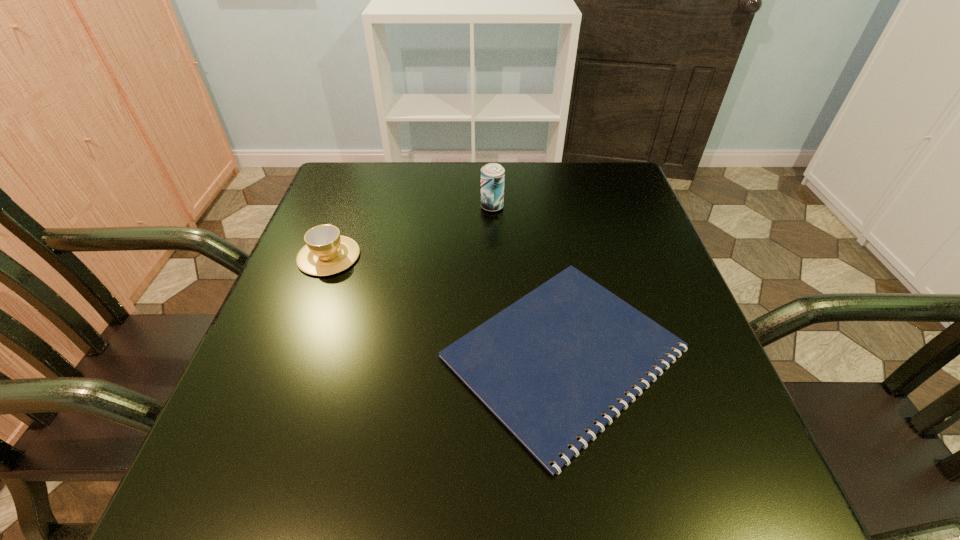
The height and width of the screenshot is (540, 960). I want to click on free space between the leftmost object and the farthest object, so click(411, 232).

Identify the location of vacant space that's between the cup and the farthest object. This screenshot has width=960, height=540. (411, 232).

The width and height of the screenshot is (960, 540). What are the coordinates of `empty location between the shortest object and the tallest object` in the screenshot? It's located at (528, 280).

At what (x,y) coordinates should I click in order to perform the action: click on free area in between the shortest object and the cup. Please return your answer as a coordinate pair (x, y). Looking at the image, I should click on (446, 305).

This screenshot has height=540, width=960. Find the location of `vacant area between the tallest object and the shortest object`. vacant area between the tallest object and the shortest object is located at coordinates (528, 280).

Identify the location of free space that is in between the leftmost object and the farthest object. (411, 232).

Locate an element on the screen. free space between the shortest object and the second shortest object is located at coordinates (446, 305).

At what (x,y) coordinates should I click in order to perform the action: click on vacant area that lies between the farthest object and the shortest object. Please return your answer as a coordinate pair (x, y). The image size is (960, 540). Looking at the image, I should click on (528, 280).

Where is `vacant space in between the second tallest object and the shortest object`? The image size is (960, 540). vacant space in between the second tallest object and the shortest object is located at coordinates (446, 305).

I want to click on empty location between the beer can and the cup, so click(x=411, y=232).